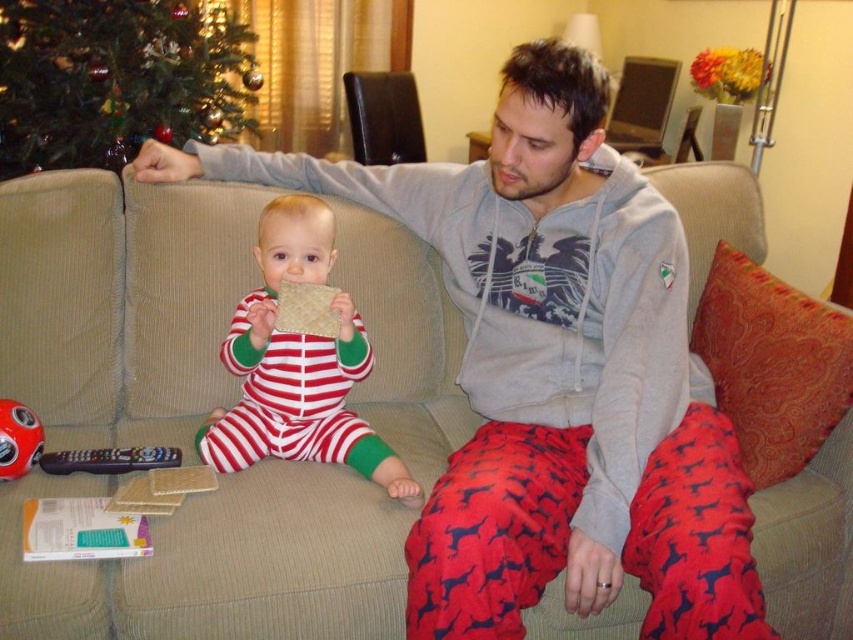
Question: Is striped cotton onesie at center to the left of black plastic remote control at lower left from the viewer's perspective?

Choices:
 (A) no
 (B) yes

Answer: (A)

Question: Which of the following is the closest to the observer?

Choices:
 (A) (136, 449)
 (B) (9, 461)
 (C) (238, 365)

Answer: (B)

Question: Considering the relative positions of green matte christmas tree at upper left and striped cotton onesie at center in the image provided, where is green matte christmas tree at upper left located with respect to striped cotton onesie at center?

Choices:
 (A) right
 (B) left

Answer: (B)

Question: Is striped cotton onesie at center positioned in front of black plastic remote control at lower left?

Choices:
 (A) yes
 (B) no

Answer: (A)

Question: Which object is positioned closest to the green matte christmas tree at upper left?

Choices:
 (A) rubberized plastic toy at lower left
 (B) striped cotton onesie at center

Answer: (B)

Question: Which object is the farthest from the rubberized plastic toy at lower left?

Choices:
 (A) green matte christmas tree at upper left
 (B) black plastic remote control at lower left

Answer: (A)